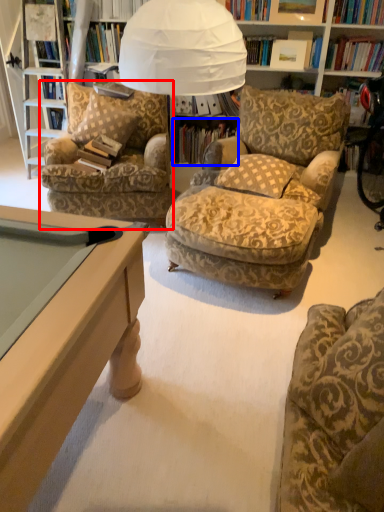
Question: Which of the following is the closest to the observer, chair (highlighted by a red box) or book (highlighted by a blue box)?

Choices:
 (A) chair
 (B) book

Answer: (A)